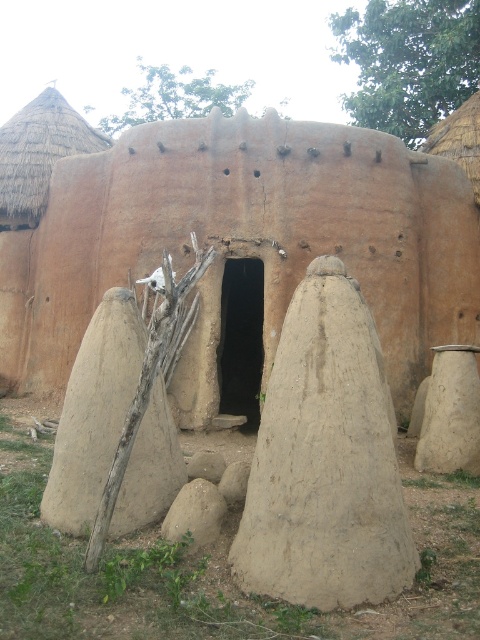
Question: From the image, what is the correct spatial relationship of brown mud hut at center in relation to beige clay pot at center?

Choices:
 (A) right
 (B) left

Answer: (B)

Question: Where is gray rough stone at center located in relation to smooth beige stone at center in the image?

Choices:
 (A) right
 (B) left

Answer: (B)

Question: In this image, where is thatched straw roof at upper left located relative to gray rough stone at center?

Choices:
 (A) below
 (B) above

Answer: (B)

Question: Which point is farther from the camera taking this photo?

Choices:
 (A) (141, 444)
 (B) (199, 506)
 (C) (54, 129)

Answer: (C)

Question: Based on their relative distances, which object is farther from the smooth beige stone at center?

Choices:
 (A) thatched straw roof at upper left
 (B) brown mud hut at center
 (C) gray rough stone at center
 (D) beige clay pot at center

Answer: (A)

Question: Among these objects, which one is nearest to the camera?

Choices:
 (A) beige clay pot at center
 (B) smooth clay pot at center
 (C) brown mud hut at center
 (D) smooth beige stone at center

Answer: (B)